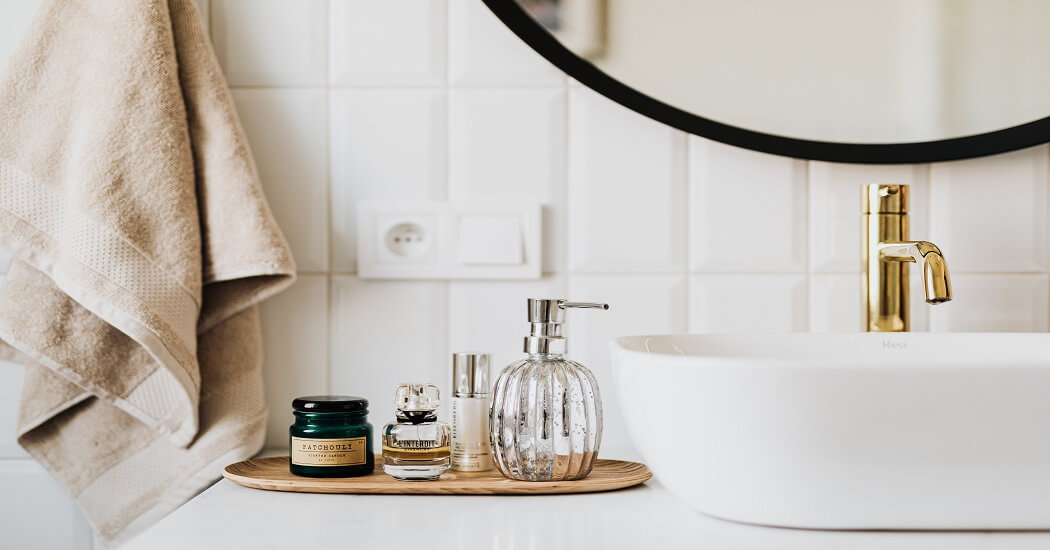
Find the location of `towel`. towel is located at coordinates (103, 201).